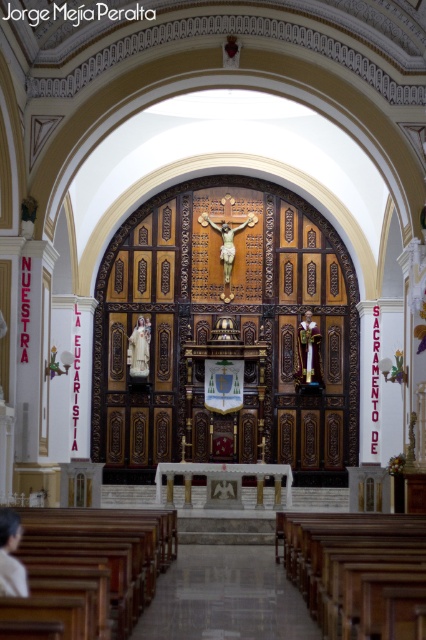
Question: Is smooth skin person at lower left below matte gold statue at center?

Choices:
 (A) yes
 (B) no

Answer: (A)

Question: Based on their relative distances, which object is farther from the smooth skin person at lower left?

Choices:
 (A) matte gold statue at center
 (B) matte white statue at center

Answer: (A)

Question: Which object appears farthest from the camera in this image?

Choices:
 (A) smooth skin person at lower left
 (B) matte gold statue at center
 (C) matte white statue at center

Answer: (B)

Question: Can you confirm if matte gold statue at center is positioned above matte white statue at center?

Choices:
 (A) yes
 (B) no

Answer: (B)

Question: Is matte gold statue at center further to the viewer compared to matte white statue at center?

Choices:
 (A) no
 (B) yes

Answer: (B)

Question: Estimate the real-world distances between objects in this image. Which object is closer to the wooden crucifix at center?

Choices:
 (A) matte gold statue at center
 (B) matte white statue at center
 (C) smooth skin person at lower left

Answer: (B)